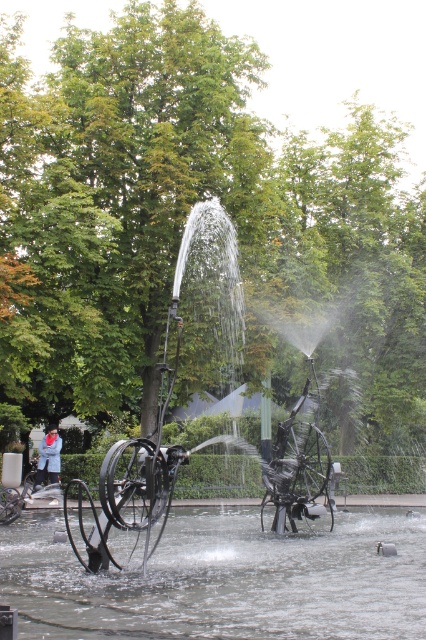
Question: Which point is farther to the camera?

Choices:
 (A) clear water at center
 (B) silver metallic bicycle at lower left

Answer: (B)

Question: Which point is closer to the camera?

Choices:
 (A) black metal sculpture at center
 (B) silver metallic bicycle at lower left
 (C) clear water at center

Answer: (C)

Question: Which of the following is the farthest from the observer?

Choices:
 (A) black metal sculpture at center
 (B) silver metallic bicycle at lower left
 (C) blue fabric jacket at lower left
 (D) clear water at center

Answer: (C)

Question: Is silver metallic bicycle at lower left closer to camera compared to blue fabric jacket at lower left?

Choices:
 (A) yes
 (B) no

Answer: (A)

Question: Does silver metallic bicycle at lower left have a lesser width compared to blue fabric jacket at lower left?

Choices:
 (A) yes
 (B) no

Answer: (A)

Question: Is black metal sculpture at center positioned behind blue fabric jacket at lower left?

Choices:
 (A) no
 (B) yes

Answer: (A)